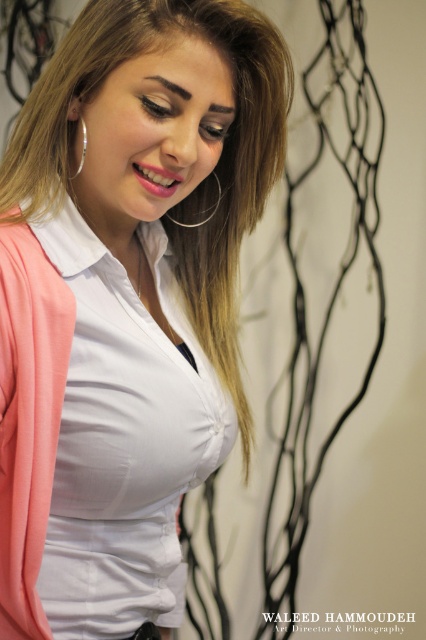
You are a photographer adjusting the camera settings to ensure both the white matte shirt at center and the silver metallic hoop at upper left are in focus. Given that the camera can only focus on objects within a 15 cm width range, can you confirm if both objects will be in focus if the shirt is wider than the hoop?

The white matte shirt at center is wider than the silver metallic hoop at upper left. Since the camera can focus on objects within a 15 cm width range, and the shirt is wider, it depends on their actual widths. However, the description only states the shirt is wider, not the exact dimensions. Without specific measurements, we cannot definitively confirm if both will fit within the 15 cm range.

Based on the scene description, what are the coordinates of the white matte shirt at center?

The white matte shirt at center is located at coordinates point (126, 301).